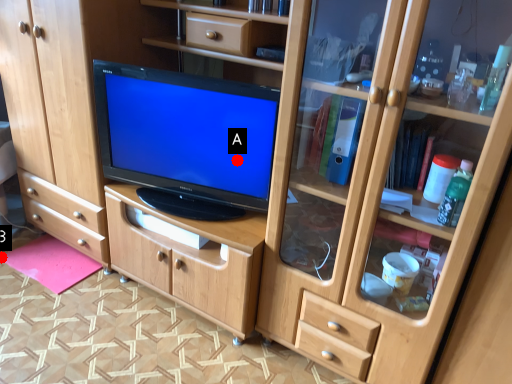
Question: Two points are circled on the image, labeled by A and B beside each circle. Which point is closer to the camera?

Choices:
 (A) A is closer
 (B) B is closer

Answer: (A)